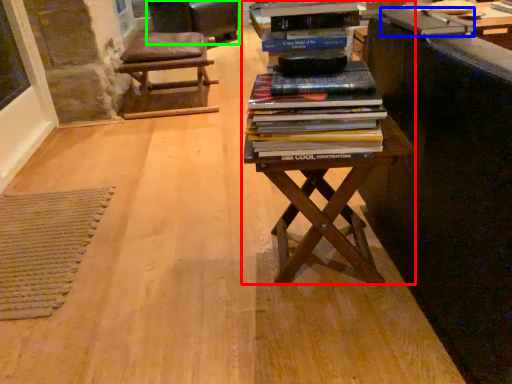
Question: Which object is positioned closest to table (highlighted by a red box)? Select from paperback book (highlighted by a blue box) and rocking chair (highlighted by a green box).

Choices:
 (A) paperback book
 (B) rocking chair

Answer: (A)